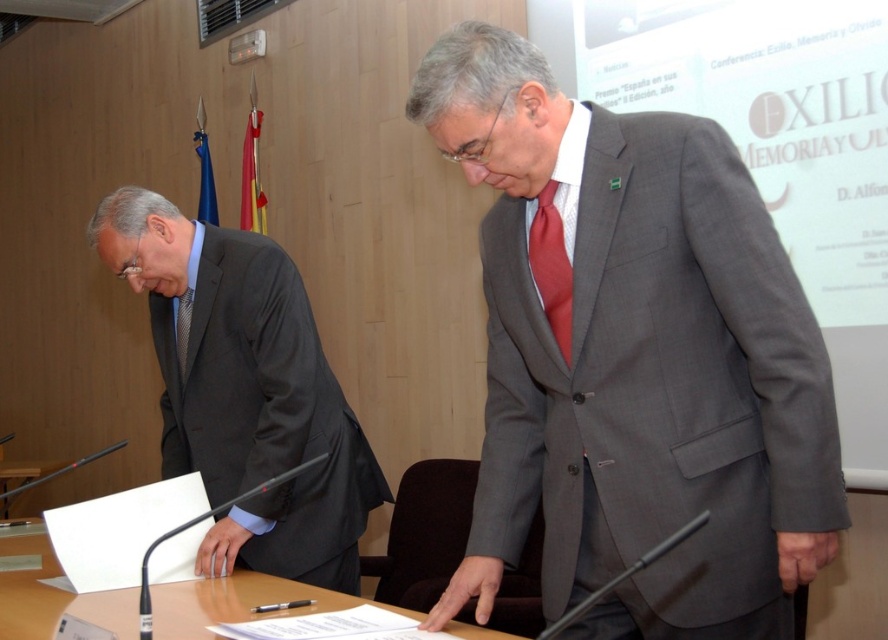
Question: Does matte gray suit at center appear on the right side of white paper at center?

Choices:
 (A) yes
 (B) no

Answer: (A)

Question: Estimate the real-world distances between objects in this image. Which object is closer to the clear glass table at center?

Choices:
 (A) silk textured tie at left
 (B) matte gray suit at center

Answer: (B)

Question: Which of the following is the closest to the observer?

Choices:
 (A) (416, 627)
 (B) (185, 323)

Answer: (A)

Question: Among these points, which one is farthest from the camera?

Choices:
 (A) (553, 589)
 (B) (148, 538)
 (C) (188, 308)
 (D) (351, 602)

Answer: (C)

Question: Does clear glass table at center appear under matte red tie at center?

Choices:
 (A) no
 (B) yes

Answer: (B)

Question: Can you confirm if dark gray suit at left is wider than silk textured tie at left?

Choices:
 (A) yes
 (B) no

Answer: (A)